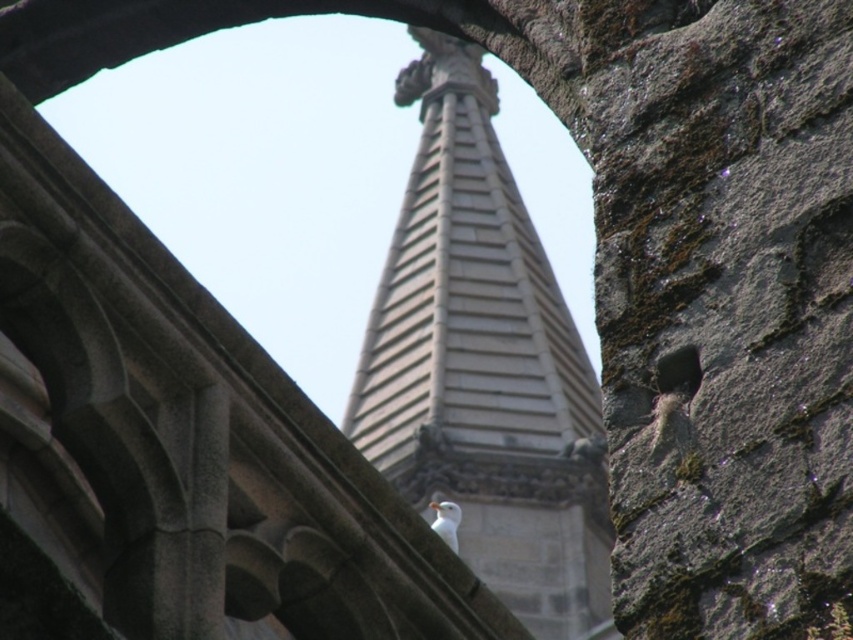
You are standing in front of the arched stone structure and see the gray stone tower at center and the white feathered bird at center. Which object is closer to the left side of the frame?

The white feathered bird at center is closer to the left side of the frame because the gray stone tower at center is positioned on the right side of it.

You are standing in front of the arched stone structure and notice both the gray stone tower at center and the white feathered bird at center. Which object is positioned higher in the scene?

The gray stone tower at center is located above the white feathered bird at center, so it is positioned higher in the scene.